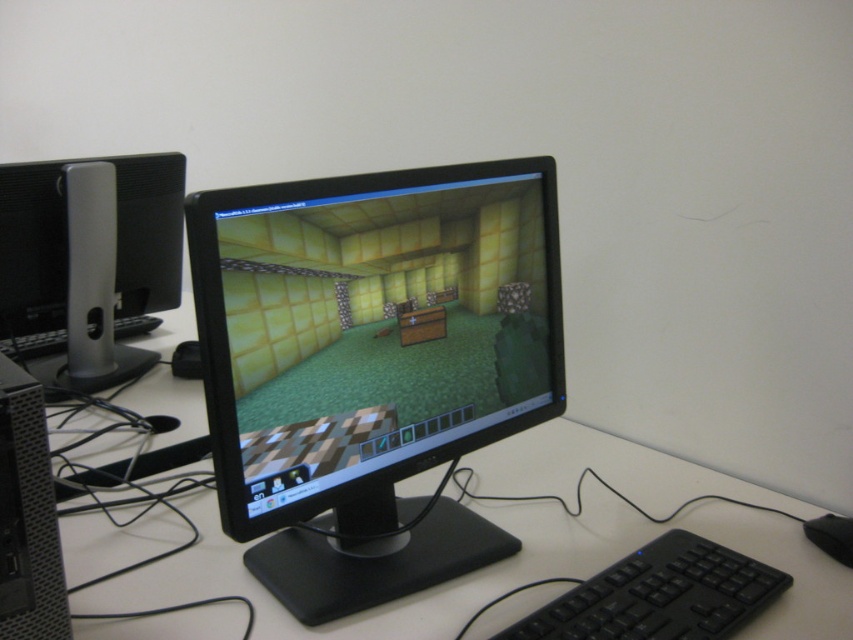
You are setting up a new cable connection between the black glossy monitor at center and the black textured computer tower at lower left. Based on their positions, which one should you plug the cable into first?

The black textured computer tower at lower left is behind the black glossy monitor at center, so you should plug the cable into the black textured computer tower at lower left first to avoid having to reach behind the monitor.

You are setting up a new cable between the black glossy monitor at center and the black textured computer tower at lower left. What is the minimum length of cable you need to connect them?

The black glossy monitor at center is 12.85 inches from the black textured computer tower at lower left, so the minimum cable length required is at least 12.85 inches to ensure a proper connection.

You are navigating a drone through the workspace shown in the image. The drone must fly from the point at coordinates point (4,410) to the point at coordinates point (848,541). Will the drone have to pass over any objects between these two points?

The point (4,410) is in front of point (848,541), so the drone will not have to pass over any objects between these two points because the path is clear.